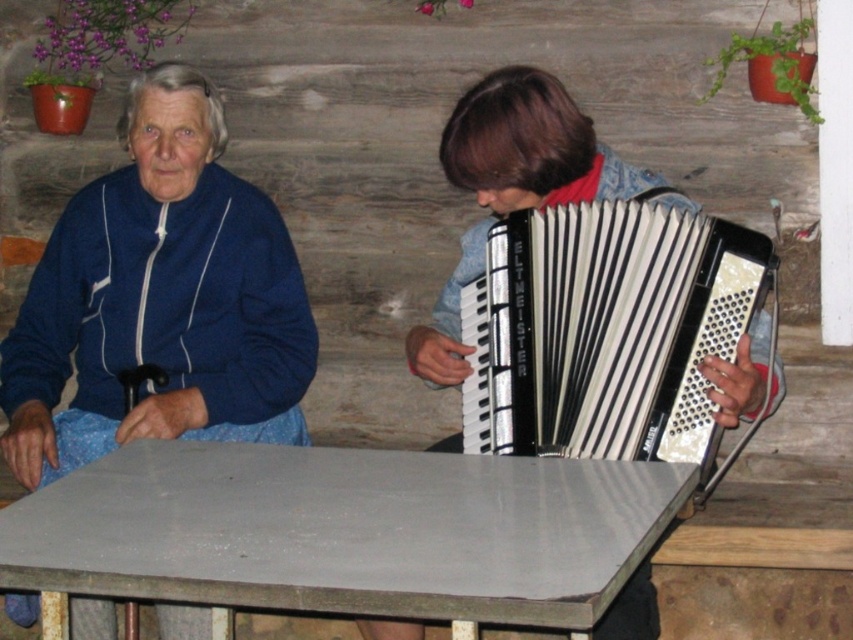
Is smooth gray table at center above black plastic accordion at right?

No, smooth gray table at center is not above black plastic accordion at right.

Which is in front, point (218, 449) or point (608, 369)?

Positioned in front is point (608, 369).

Where is `smooth gray table at center`? This screenshot has height=640, width=853. smooth gray table at center is located at coordinates (341, 532).

Does point (149, 301) come farther from viewer compared to point (460, 358)?

Yes, it is behind point (460, 358).

Can you confirm if blue fabric at left is bigger than metallic accordion at center?

Yes, blue fabric at left is bigger than metallic accordion at center.

Which is behind, point (219, 365) or point (561, 138)?

Positioned behind is point (219, 365).

You are a GUI agent. You are given a task and a screenshot of the screen. Output one action in this format:
    pyautogui.click(x=<x>, y=<y>)
    Task: Click on the blue fabric at left
    The width and height of the screenshot is (853, 640).
    Given the screenshot: What is the action you would take?
    pyautogui.click(x=160, y=300)

Who is lower down, black plastic accordion at right or metallic accordion at center?

black plastic accordion at right

Does black plastic accordion at right appear under metallic accordion at center?

Yes, black plastic accordion at right is below metallic accordion at center.

In order to click on black plastic accordion at right in this screenshot , I will do `click(606, 330)`.

You are a GUI agent. You are given a task and a screenshot of the screen. Output one action in this format:
    pyautogui.click(x=<x>, y=<y>)
    Task: Click on the black plastic accordion at right
    
    Given the screenshot: What is the action you would take?
    click(606, 330)